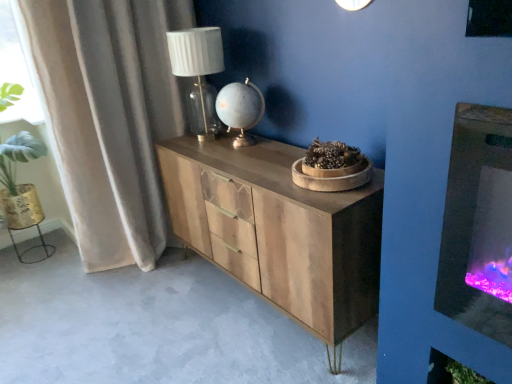
You are a GUI agent. You are given a task and a screenshot of the screen. Output one action in this format:
    pyautogui.click(x=<x>, y=<y>)
    Task: Click on the matte white glass table lamp at upper center
    
    Given the screenshot: What is the action you would take?
    pyautogui.click(x=198, y=73)

Is matte white glass table lamp at upper center with velvet beige curtain at left?

They are not placed beside each other.

Is velvet beige curtain at left at the back of matte white glass table lamp at upper center?

No, matte white glass table lamp at upper center's orientation is not away from velvet beige curtain at left.

Is matte white glass table lamp at upper center taller or shorter than velvet beige curtain at left?

Considering their sizes, matte white glass table lamp at upper center has less height than velvet beige curtain at left.

From a real-world perspective, is matte white glass table lamp at upper center positioned under velvet beige curtain at left based on gravity?

Actually, matte white glass table lamp at upper center is physically above velvet beige curtain at left in the real world.

The height and width of the screenshot is (384, 512). In the image, there is a matte white glass table lamp at upper center. In order to click on the chest of drawers below it (from a real-world perspective) in this screenshot , I will do `click(279, 230)`.

Could you measure the distance between matte white glass table lamp at upper center and wooden chest of drawers at center?

matte white glass table lamp at upper center is 21.53 inches from wooden chest of drawers at center.

From the image's perspective, which is below, matte white glass table lamp at upper center or wooden chest of drawers at center?

wooden chest of drawers at center, from the image's perspective.

Is matte white glass table lamp at upper center oriented away from wooden chest of drawers at center?

No, matte white glass table lamp at upper center is not facing away from wooden chest of drawers at center.

Does wooden chest of drawers at center appear on the left side of matte white glass table lamp at upper center?

No, wooden chest of drawers at center is not to the left of matte white glass table lamp at upper center.

Choose the correct answer: Is wooden chest of drawers at center inside matte white glass table lamp at upper center or outside it?

wooden chest of drawers at center exists outside the volume of matte white glass table lamp at upper center.

Consider the image. From a real-world perspective, who is located lower, wooden chest of drawers at center or matte white glass table lamp at upper center?

wooden chest of drawers at center, from a real-world perspective.

Which is behind, point (236, 245) or point (211, 39)?

Point (211, 39)

Can you see wooden chest of drawers at center touching velvet beige curtain at left?

There is a gap between wooden chest of drawers at center and velvet beige curtain at left.

Consider the image. Does wooden chest of drawers at center have a lesser width compared to velvet beige curtain at left?

In fact, wooden chest of drawers at center might be wider than velvet beige curtain at left.

Does point (304, 246) come closer to viewer compared to point (137, 215)?

Yes, it is.

Does wooden chest of drawers at center have a lesser height compared to velvet beige curtain at left?

Yes, wooden chest of drawers at center is shorter than velvet beige curtain at left.

Is velvet beige curtain at left taller than matte white glass table lamp at upper center?

Indeed, velvet beige curtain at left has a greater height compared to matte white glass table lamp at upper center.

Which is less distant, (186, 10) or (219, 46)?

Point (186, 10).

Is velvet beige curtain at left inside or outside of matte white glass table lamp at upper center?

velvet beige curtain at left is not enclosed by matte white glass table lamp at upper center.

Who is smaller, velvet beige curtain at left or matte white glass table lamp at upper center?

matte white glass table lamp at upper center is smaller.

Is velvet beige curtain at left positioned in front of wooden chest of drawers at center?

No, it is behind wooden chest of drawers at center.

Based on the photo, from the image's perspective, is velvet beige curtain at left under wooden chest of drawers at center?

Incorrect, from the image's perspective, velvet beige curtain at left is higher than wooden chest of drawers at center.

Is wooden chest of drawers at center at the back of velvet beige curtain at left?

No, velvet beige curtain at left is not facing away from wooden chest of drawers at center.

Looking at this image, in terms of size, does velvet beige curtain at left appear bigger or smaller than wooden chest of drawers at center?

Considering their sizes, velvet beige curtain at left takes up less space than wooden chest of drawers at center.

Where is `curtain directly beneath the matte white glass table lamp at upper center (from a real-world perspective)`? This screenshot has width=512, height=384. curtain directly beneath the matte white glass table lamp at upper center (from a real-world perspective) is located at coordinates (110, 117).

Locate an element on the screen. table lamp above the wooden chest of drawers at center (from a real-world perspective) is located at coordinates (198, 73).

When comparing their distances from wooden chest of drawers at center, does matte white glass table lamp at upper center or velvet beige curtain at left seem further?

velvet beige curtain at left lies further to wooden chest of drawers at center than the other object.

Based on their spatial positions, is matte white glass table lamp at upper center or wooden chest of drawers at center closer to velvet beige curtain at left?

Based on the image, matte white glass table lamp at upper center appears to be nearer to velvet beige curtain at left.

Based on their spatial positions, is wooden chest of drawers at center or matte white glass table lamp at upper center further from velvet beige curtain at left?

Based on the image, wooden chest of drawers at center appears to be further to velvet beige curtain at left.

From the image, which object appears to be nearer to wooden chest of drawers at center, velvet beige curtain at left or matte white glass table lamp at upper center?

matte white glass table lamp at upper center.

Based on the photo, when comparing their distances from matte white glass table lamp at upper center, does wooden chest of drawers at center or velvet beige curtain at left seem closer?

velvet beige curtain at left is positioned closer to the anchor matte white glass table lamp at upper center.

Estimate the real-world distances between objects in this image. Which object is closer to matte white glass table lamp at upper center, velvet beige curtain at left or wooden chest of drawers at center?

velvet beige curtain at left.

Where is `curtain that lies between matte white glass table lamp at upper center and wooden chest of drawers at center from top to bottom`? The width and height of the screenshot is (512, 384). curtain that lies between matte white glass table lamp at upper center and wooden chest of drawers at center from top to bottom is located at coordinates (110, 117).